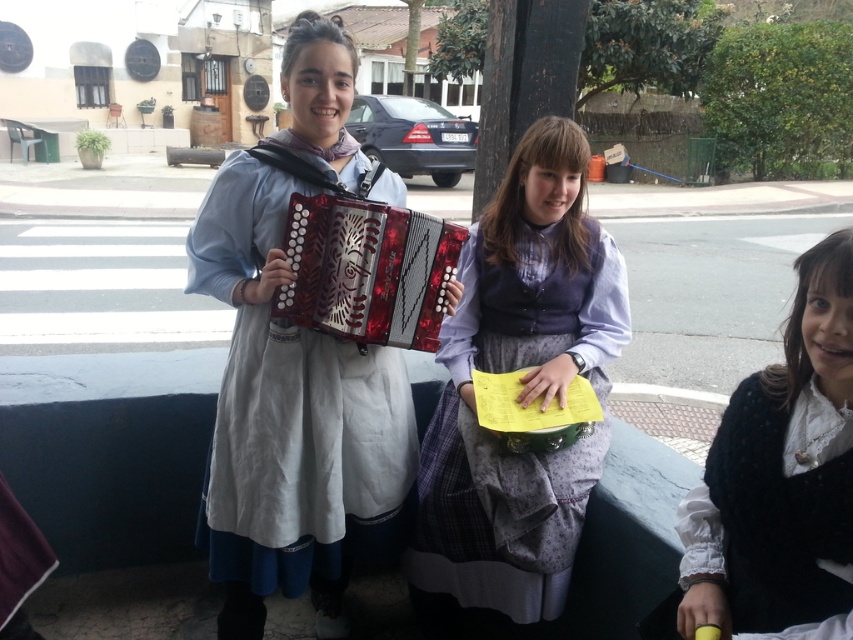
Question: Is matte black accordion at center positioned before black fuzzy sweater at lower right?

Choices:
 (A) yes
 (B) no

Answer: (B)

Question: Is matte purple vest at center above black fuzzy sweater at lower right?

Choices:
 (A) no
 (B) yes

Answer: (B)

Question: Considering the real-world distances, which object is closest to the shiny red wood accordion at center?

Choices:
 (A) black fuzzy sweater at lower right
 (B) matte purple vest at center

Answer: (B)

Question: Is matte black accordion at center bigger than black fuzzy sweater at lower right?

Choices:
 (A) yes
 (B) no

Answer: (A)

Question: Which point appears farthest from the camera in this image?

Choices:
 (A) (795, 516)
 (B) (451, 580)

Answer: (B)

Question: Which object is positioned farthest from the matte black accordion at center?

Choices:
 (A) matte purple vest at center
 (B) black fuzzy sweater at lower right
 (C) shiny red wood accordion at center

Answer: (B)